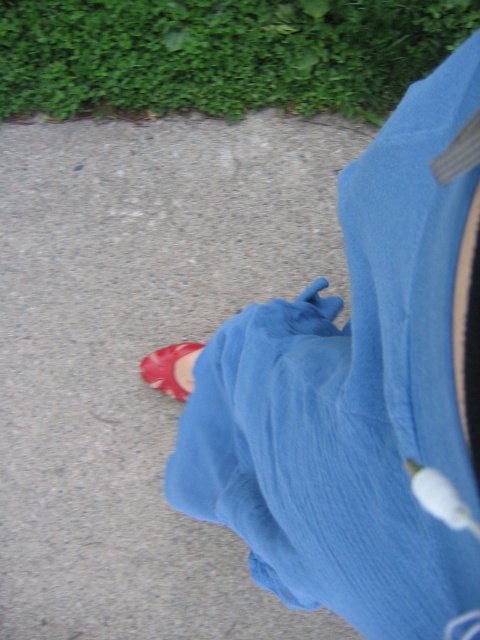
Does gray concrete pavement at center appear on the right side of matte blue pants at lower center?

In fact, gray concrete pavement at center is to the left of matte blue pants at lower center.

Who is taller, gray concrete pavement at center or matte blue pants at lower center?

With more height is gray concrete pavement at center.

Who is more distant from viewer, (58, 168) or (431, 292)?

Positioned behind is point (58, 168).

Image resolution: width=480 pixels, height=640 pixels. What are the coordinates of `gray concrete pavement at center` in the screenshot? It's located at (140, 356).

Who is positioned more to the left, gray concrete pavement at center or shiny red shoe at lower left?

shiny red shoe at lower left

Can you confirm if gray concrete pavement at center is bigger than shiny red shoe at lower left?

Yes.

Which is in front, point (199, 268) or point (171, 362)?

Positioned in front is point (171, 362).

Locate an element on the screen. The image size is (480, 640). gray concrete pavement at center is located at coordinates (140, 356).

Who is taller, matte blue pants at lower center or shiny red shoe at lower left?

matte blue pants at lower center is taller.

Is matte blue pants at lower center to the right of shiny red shoe at lower left from the viewer's perspective?

Correct, you'll find matte blue pants at lower center to the right of shiny red shoe at lower left.

In order to click on matte blue pants at lower center in this screenshot , I will do [x=359, y=392].

This screenshot has width=480, height=640. I want to click on matte blue pants at lower center, so click(359, 392).